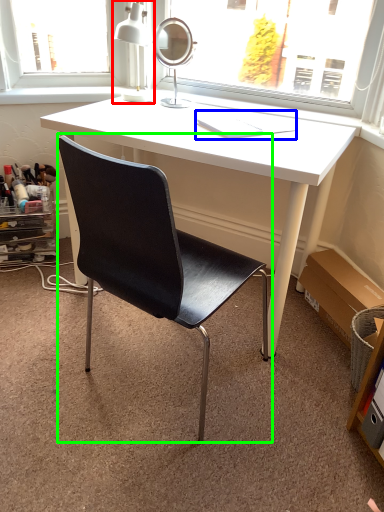
Question: Which is nearer to the table lamp (highlighted by a red box)? book (highlighted by a blue box) or chair (highlighted by a green box).

Choices:
 (A) book
 (B) chair

Answer: (A)